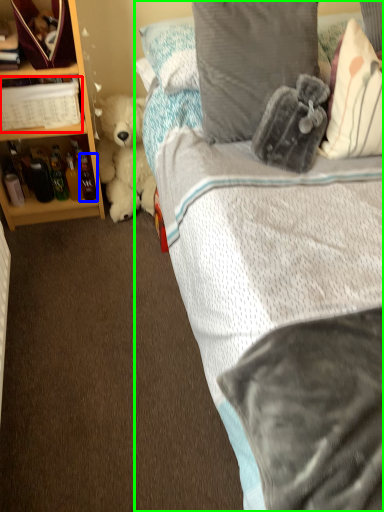
Question: Which object is positioned farthest from book (highlighted by a red box)? Select from bottle (highlighted by a blue box) and bed (highlighted by a green box).

Choices:
 (A) bottle
 (B) bed

Answer: (B)